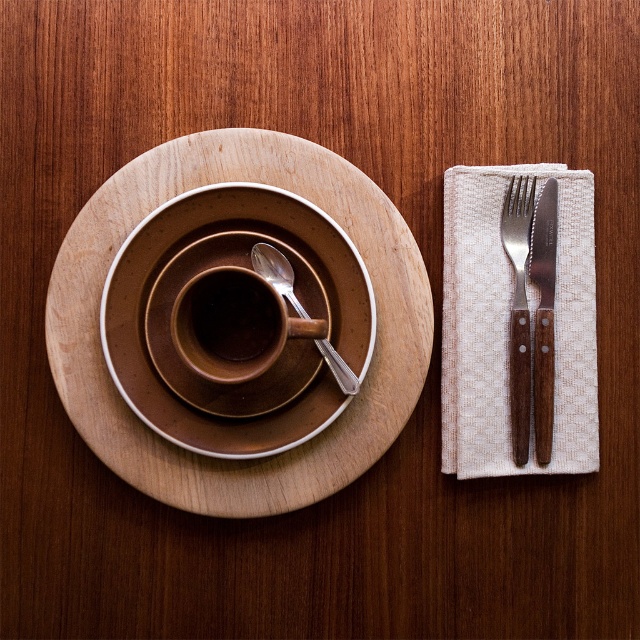
Question: Is matte brown cup at center to the right of brown wooden knife at right from the viewer's perspective?

Choices:
 (A) no
 (B) yes

Answer: (A)

Question: Does matte brown cup at center come behind wooden fork at right?

Choices:
 (A) no
 (B) yes

Answer: (A)

Question: Estimate the real-world distances between objects in this image. Which object is closer to the wooden fork at right?

Choices:
 (A) brown wooden knife at right
 (B) matte silver spoon at center
 (C) matte brown cup at center
 (D) brown matte platter at center

Answer: (A)

Question: Is brown matte platter at center thinner than matte brown cup at center?

Choices:
 (A) no
 (B) yes

Answer: (A)

Question: Which object is farther from the camera taking this photo?

Choices:
 (A) matte silver spoon at center
 (B) matte brown cup at center

Answer: (A)

Question: Which point is closer to the camera taking this photo?

Choices:
 (A) pyautogui.click(x=264, y=269)
 (B) pyautogui.click(x=397, y=380)
 (C) pyautogui.click(x=532, y=221)

Answer: (A)